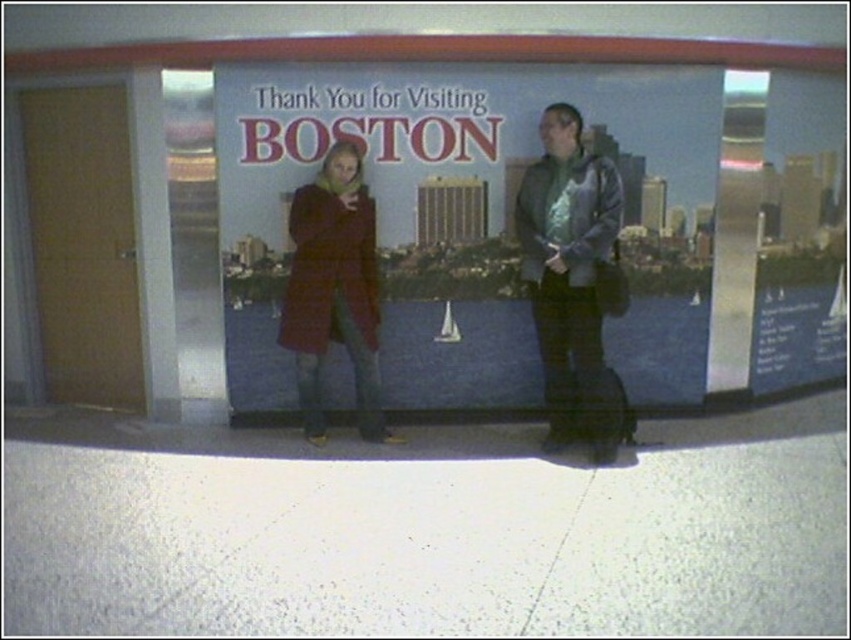
Based on the photo, you are a photographer trying to capture a photo of the matte plastic poster at center and the matte red coat at center. Since you want both objects to appear clearly in the frame, which one should you focus on first to ensure proper focus?

The matte plastic poster at center is larger in size than the matte red coat at center, so you should focus on the matte plastic poster at center first to ensure it appears clearly in the frame.

You are a photographer trying to capture both the metallic silver jacket at right and the matte red coat at center in a single frame. Which object should you focus on first to ensure both are in the frame?

The metallic silver jacket at right is smaller than the matte red coat at center, so you should focus on the matte red coat at center first to ensure both fit within the frame.